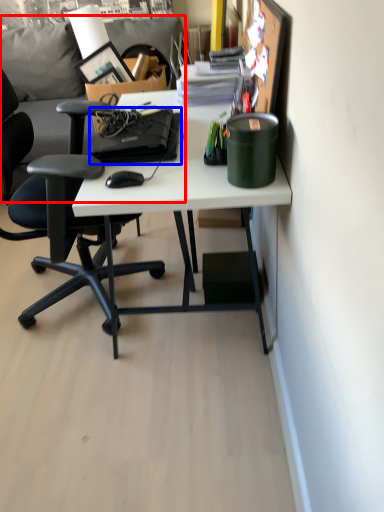
Question: Which point is further to the camera, couch (highlighted by a red box) or laptop (highlighted by a blue box)?

Choices:
 (A) couch
 (B) laptop

Answer: (A)